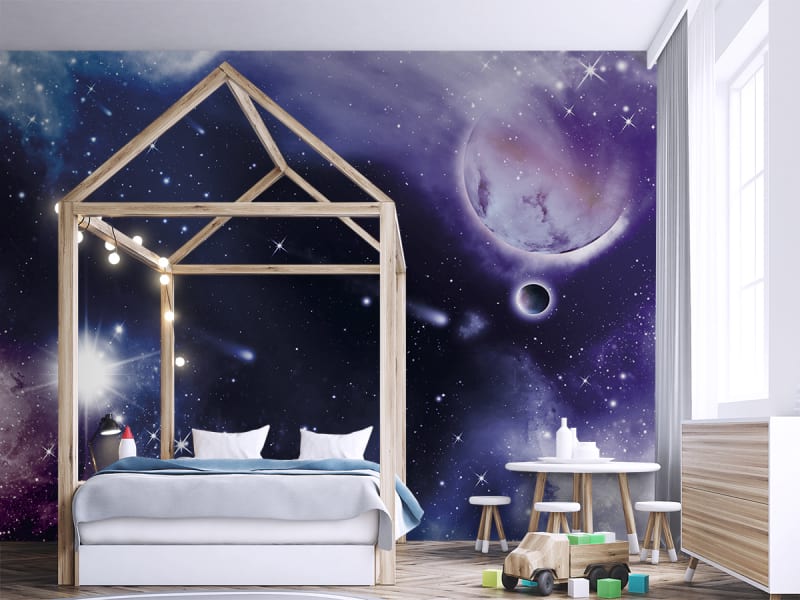
Image resolution: width=800 pixels, height=600 pixels. I want to click on blue blanket on bed, so click(x=248, y=462).